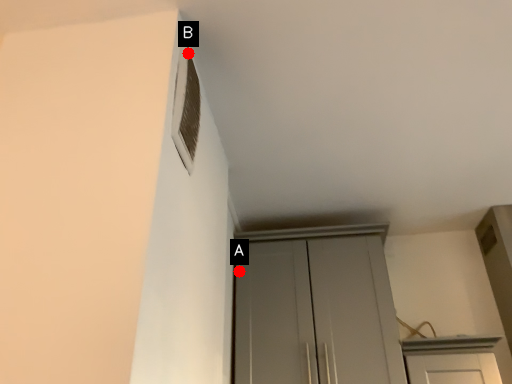
Question: Two points are circled on the image, labeled by A and B beside each circle. Which of the following is the closest to the observer?

Choices:
 (A) A is closer
 (B) B is closer

Answer: (B)